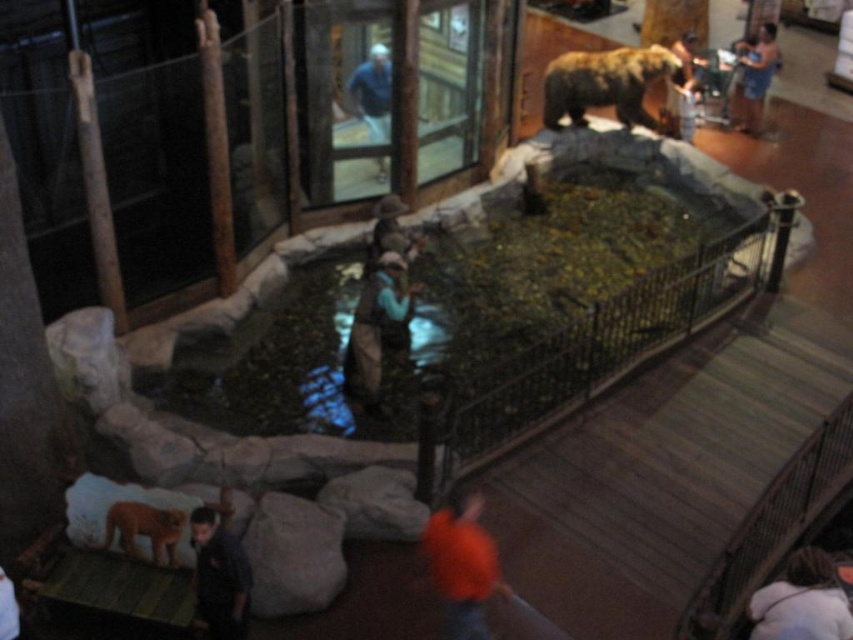
Question: Is brown leather jacket at center to the right of orange fur tiger at lower left from the viewer's perspective?

Choices:
 (A) no
 (B) yes

Answer: (B)

Question: Which object is closer to the camera taking this photo?

Choices:
 (A) orange fur tiger at lower left
 (B) dark blue shirt at lower center
 (C) brown fur bear at upper center
 (D) black metal rail at center

Answer: (B)

Question: Which point appears farthest from the camera in this image?

Choices:
 (A) (367, 84)
 (B) (138, 513)

Answer: (A)

Question: Can you confirm if dark brown hair at lower right is positioned to the left of orange fur tiger at lower left?

Choices:
 (A) no
 (B) yes

Answer: (A)

Question: Is brown fur bear at upper center positioned behind denim shorts at upper right?

Choices:
 (A) no
 (B) yes

Answer: (A)

Question: Which of the following is the farthest from the observer?

Choices:
 (A) click(x=747, y=52)
 (B) click(x=572, y=54)
 (C) click(x=357, y=97)
 (D) click(x=368, y=396)

Answer: (A)